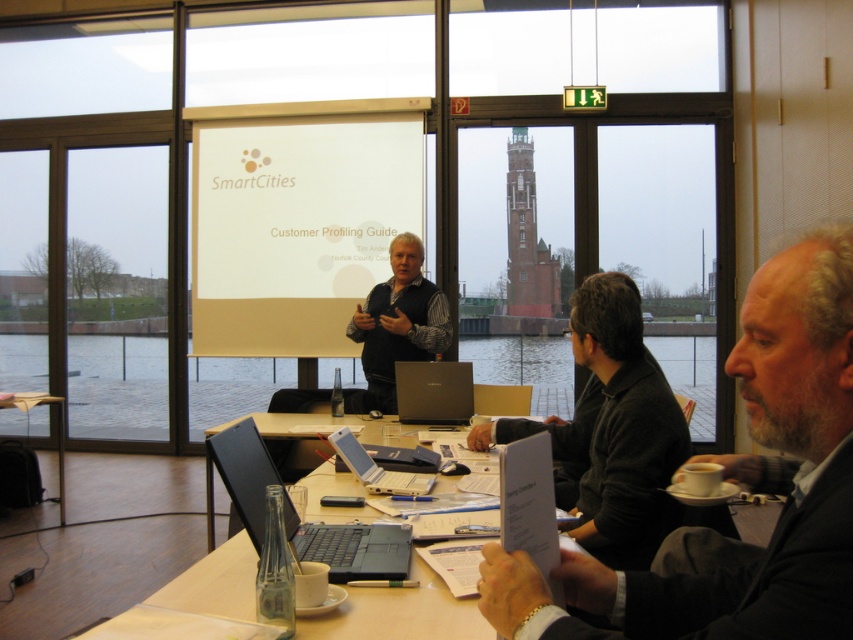
Does point (434, 342) lie in front of point (451, 380)?

No, (434, 342) is behind (451, 380).

Locate an element on the screen. matte black shirt at center is located at coordinates 398,323.

Between dark gray suit at center and satin black laptop at center, which one appears on the right side from the viewer's perspective?

From the viewer's perspective, dark gray suit at center appears more on the right side.

I want to click on dark gray suit at center, so pos(741,481).

What do you see at coordinates (741, 481) in the screenshot?
I see `dark gray suit at center` at bounding box center [741, 481].

The width and height of the screenshot is (853, 640). What are the coordinates of `dark gray suit at center` in the screenshot? It's located at (741, 481).

Is matte black laptop at center shorter than satin black laptop at center?

Yes.

Is matte black laptop at center in front of satin black laptop at center?

Yes, matte black laptop at center is in front of satin black laptop at center.

Image resolution: width=853 pixels, height=640 pixels. What are the coordinates of `matte black laptop at center` in the screenshot? It's located at (195, 596).

This screenshot has height=640, width=853. What are the coordinates of `matte black laptop at center` in the screenshot? It's located at (195, 596).